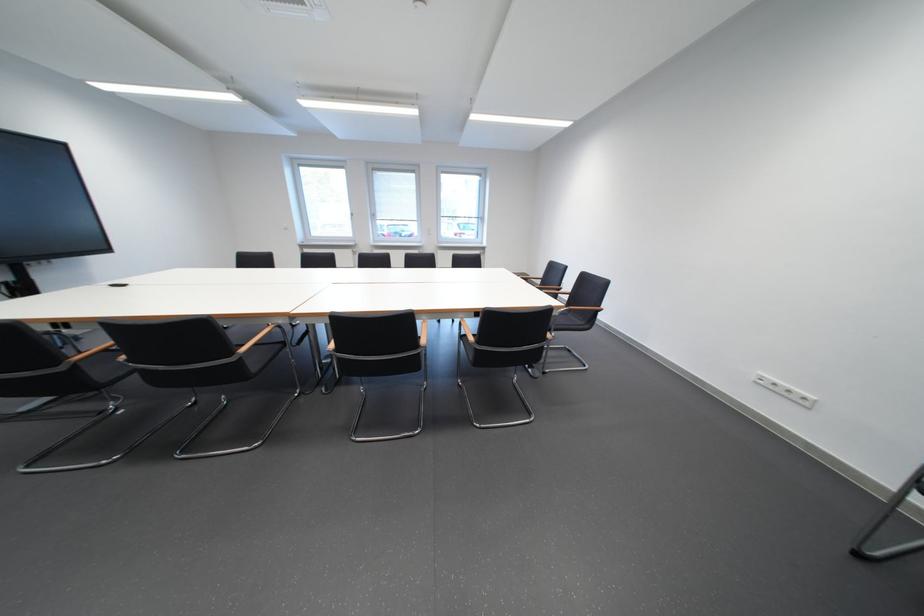
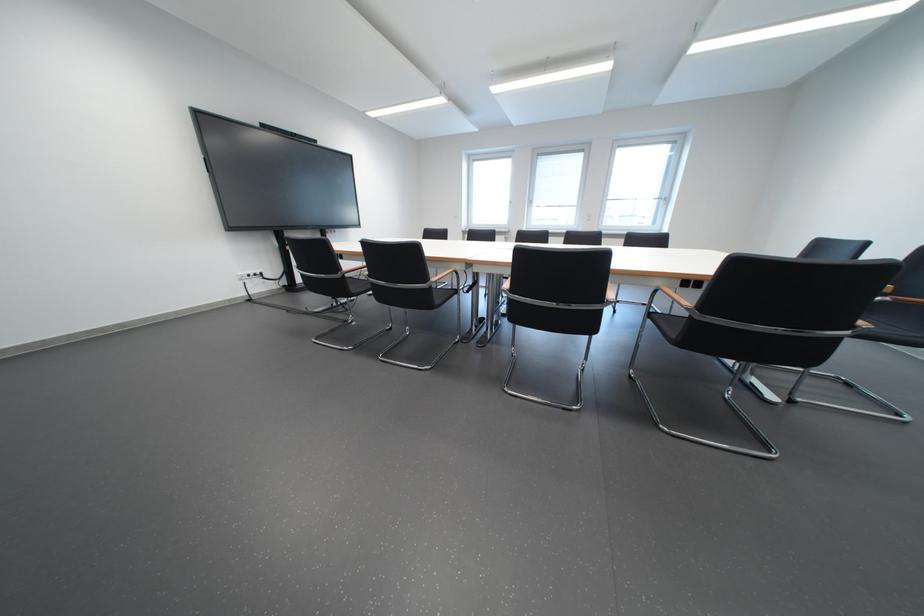
Question: The camera is either moving clockwise (left) or counter-clockwise (right) around the object. The first image is from the beginning of the video and the second image is from the end. Is the camera moving left or right when shooting the video?

Choices:
 (A) Left
 (B) Right

Answer: (B)